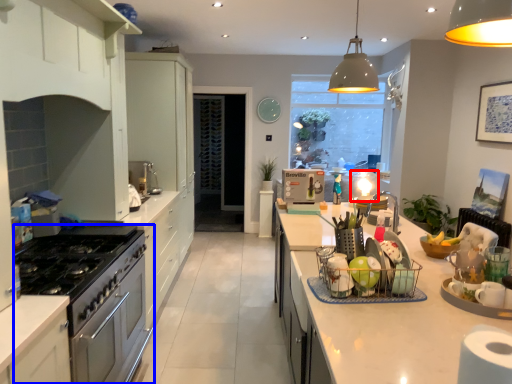
Question: Which object is closer to the camera taking this photo, appliance (highlighted by a red box) or kitchen appliance (highlighted by a blue box)?

Choices:
 (A) appliance
 (B) kitchen appliance

Answer: (B)